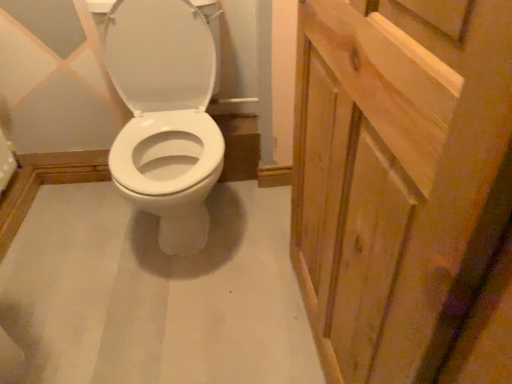
Question: Can you confirm if white glossy toilet seat at left is thinner than natural wood screen door at right?

Choices:
 (A) no
 (B) yes

Answer: (A)

Question: Is white glossy toilet seat at left far away from natural wood screen door at right?

Choices:
 (A) yes
 (B) no

Answer: (B)

Question: Considering the relative sizes of white glossy toilet seat at left and natural wood screen door at right in the image provided, is white glossy toilet seat at left smaller than natural wood screen door at right?

Choices:
 (A) no
 (B) yes

Answer: (A)

Question: Is white glossy toilet seat at left facing towards natural wood screen door at right?

Choices:
 (A) no
 (B) yes

Answer: (A)

Question: Is white glossy toilet seat at left in front of natural wood screen door at right?

Choices:
 (A) no
 (B) yes

Answer: (A)

Question: From the image's perspective, is white glossy toilet seat at left over natural wood screen door at right?

Choices:
 (A) no
 (B) yes

Answer: (B)

Question: From a real-world perspective, is natural wood screen door at right located beneath white glossy toilet seat at left?

Choices:
 (A) yes
 (B) no

Answer: (B)

Question: Is the position of natural wood screen door at right less distant than that of white glossy toilet seat at left?

Choices:
 (A) yes
 (B) no

Answer: (A)

Question: From a real-world perspective, is natural wood screen door at right over white glossy toilet seat at left?

Choices:
 (A) no
 (B) yes

Answer: (B)

Question: Can you confirm if natural wood screen door at right is positioned to the right of white glossy toilet seat at left?

Choices:
 (A) no
 (B) yes

Answer: (B)

Question: Is white glossy toilet seat at left surrounded by natural wood screen door at right?

Choices:
 (A) no
 (B) yes

Answer: (A)

Question: Can you confirm if natural wood screen door at right is shorter than white glossy toilet seat at left?

Choices:
 (A) no
 (B) yes

Answer: (A)

Question: Is natural wood screen door at right inside the boundaries of white glossy toilet seat at left, or outside?

Choices:
 (A) inside
 (B) outside

Answer: (B)